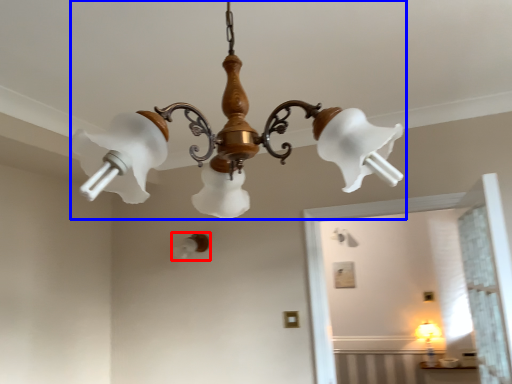
Question: Which point is closer to the camera, lamp (highlighted by a red box) or lamp (highlighted by a blue box)?

Choices:
 (A) lamp
 (B) lamp

Answer: (B)